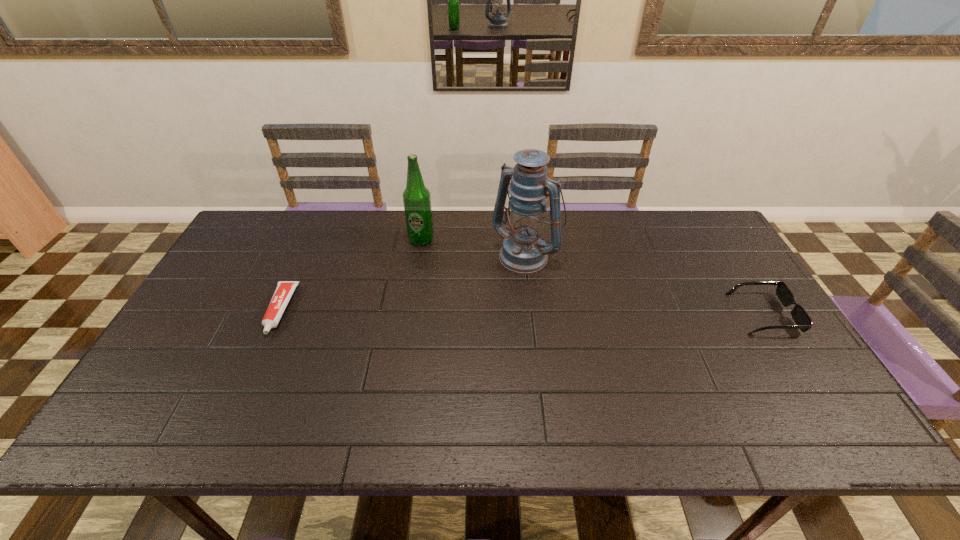
Locate an element on the screen. Image resolution: width=960 pixels, height=540 pixels. blank area in the image that satisfies the following two spatial constraints: 1. at the nozzle of the leftmost object; 2. on the front-facing side of the rightmost object is located at coordinates (278, 314).

Locate an element on the screen. Image resolution: width=960 pixels, height=540 pixels. vacant region that satisfies the following two spatial constraints: 1. at the nozzle of the third tallest object; 2. on the front-facing side of the toothpaste is located at coordinates (278, 314).